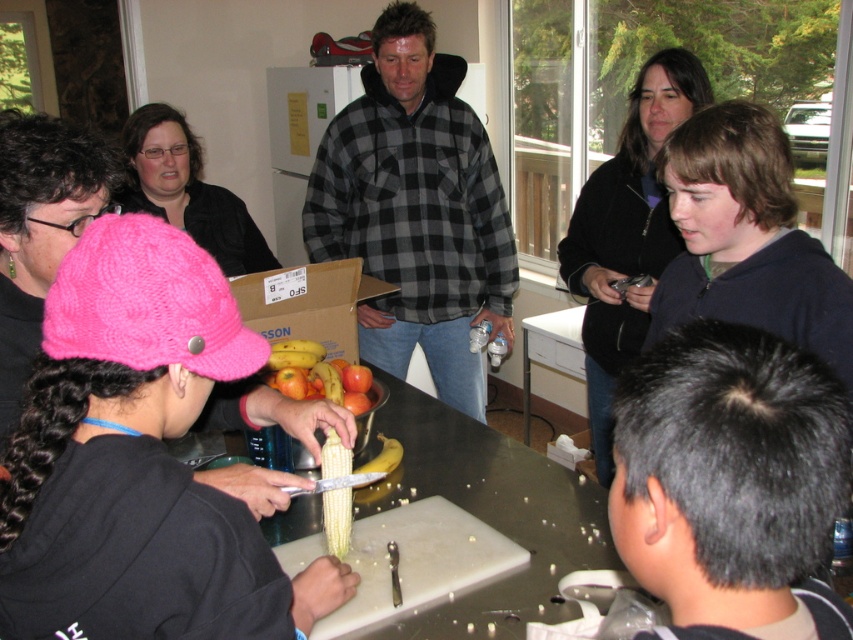
You are a photographer trying to capture a candid shot of the dark gray hair at lower right and the black checkered shirt at center. Based on their positions, which subject would you need to focus on first if you want to ensure both are in the same frame?

The dark gray hair at lower right is below the black checkered shirt at center, so you should focus on the black checkered shirt at center first to ensure both are in the frame.

In the scene described, there is a dark gray hair at lower right. Where exactly is it located in terms of coordinates?

The dark gray hair at lower right is located at point (x=729, y=481).

You are a chef preparing a dish and need to reach both the black checkered shirt at center and the yellow matte banana at center. If your arm can extend 1 meter, can you reach both items without moving?

The black checkered shirt at center is 1.03 meters away from the yellow matte banana at center. Since your arm can only extend 1 meter, you cannot reach both items without moving.